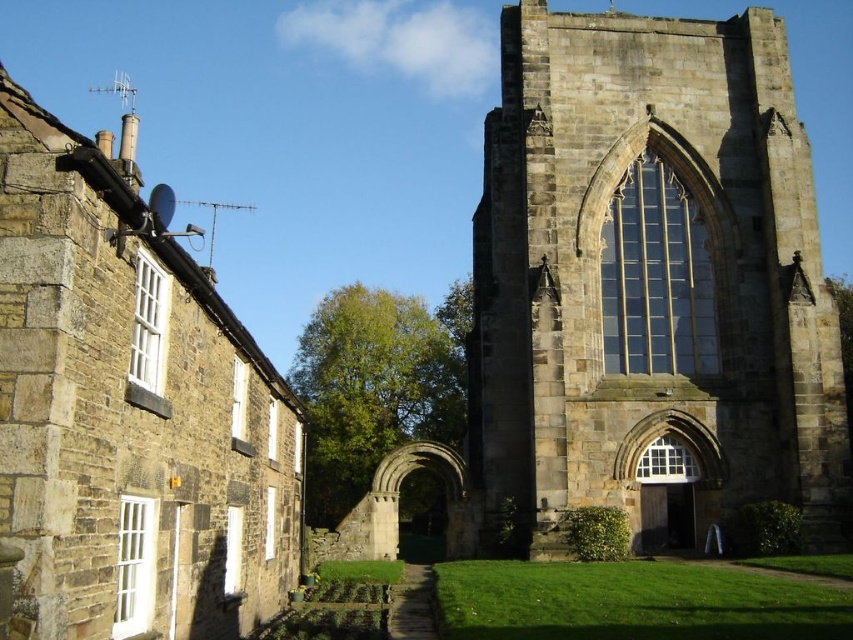
Question: Which point appears closest to the camera in this image?

Choices:
 (A) (625, 477)
 (B) (265, 388)

Answer: (B)

Question: Which of the following is the farthest from the observer?

Choices:
 (A) (289, 579)
 (B) (741, 93)

Answer: (B)

Question: Does stone gothic tower at center appear over stone church at upper center?

Choices:
 (A) no
 (B) yes

Answer: (A)

Question: Can you confirm if stone gothic tower at center is bigger than stone church at upper center?

Choices:
 (A) no
 (B) yes

Answer: (A)

Question: Is stone gothic tower at center to the right of stone church at upper center from the viewer's perspective?

Choices:
 (A) no
 (B) yes

Answer: (B)